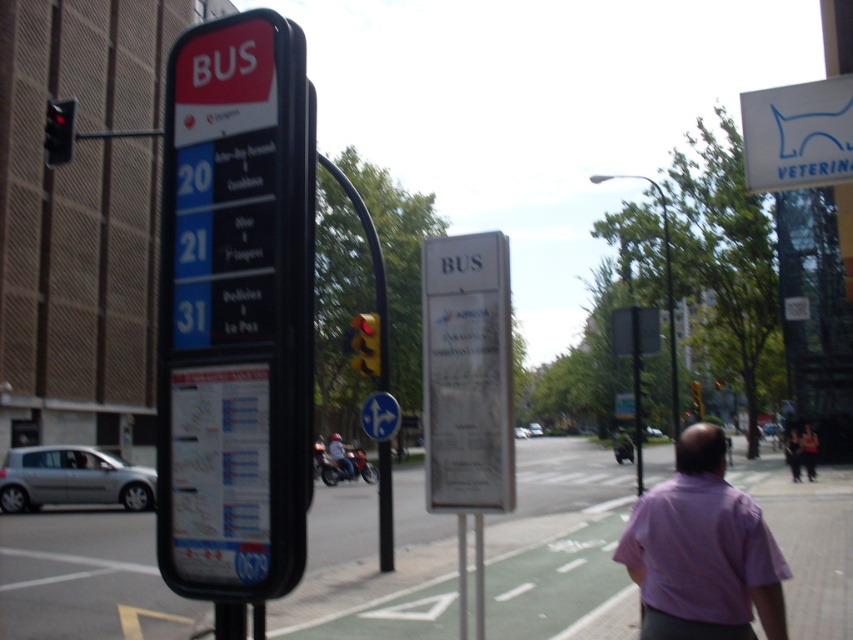
You are standing at the bus stop and see two shirts, a purple cotton shirt at lower right and a pink cotton shirt at lower right. Which shirt is nearer to you?

The purple cotton shirt at lower right is closer to the viewer than the pink cotton shirt at lower right.